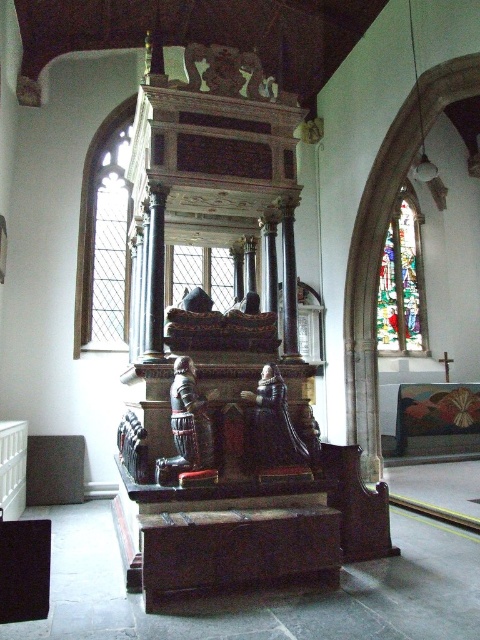
You are an architect designing a new church and want to ensure proper lighting. You observe the stained glass window at upper right and the clear glass window at center. Which window allows more natural light into the church?

The clear glass window at center allows more natural light into the church because stained glass windows typically filter or reduce light due to their colored and textured design, whereas clear glass transmits light more effectively. However, according to the provided description, the stained glass window at upper right is much taller than the clear glass window at center. A taller window might allow more light if its area is larger, but since the question focuses on the type of glass, the clear glass would

You are an architect designing a new church and want to replicate the spatial arrangement of the clear glass window at left and the clear glass window at center from the image. Which window should be placed higher to maintain the same spatial relationship?

The clear glass window at left should be placed higher than the clear glass window at center to maintain the same spatial relationship as in the image.

You are an interior designer planning to install a new chandelier in the church. The chandelier you have chosen is wider than the wooden statue at center. Can you determine if the stained glass window at upper right has enough space to accommodate the chandelier based on its width?

The stained glass window at upper right is wider than the wooden statue at center. Since the chandelier is wider than the wooden statue at center, the stained glass window at upper right may have sufficient width to accommodate the chandelier, but further measurements are needed to confirm.